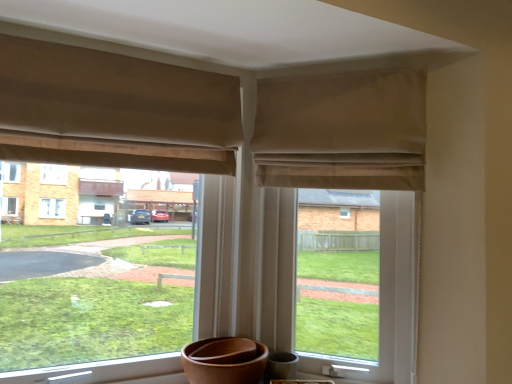
Question: Would you say beige fabric window at center is a long distance from beige fabric curtain at upper left, which appears as the 1th curtain when viewed from the left?

Choices:
 (A) no
 (B) yes

Answer: (A)

Question: Can you confirm if beige fabric window at center is shorter than beige fabric curtain at upper left, the second curtain in the right-to-left sequence?

Choices:
 (A) no
 (B) yes

Answer: (A)

Question: Is beige fabric window at center positioned in front of beige fabric curtain at upper left, the second curtain in the right-to-left sequence?

Choices:
 (A) no
 (B) yes

Answer: (A)

Question: Is beige fabric window at center further to the viewer compared to beige fabric curtain at upper left, the second curtain in the right-to-left sequence?

Choices:
 (A) yes
 (B) no

Answer: (A)

Question: Can you confirm if beige fabric window at center is bigger than beige fabric curtain at upper left, the second curtain in the right-to-left sequence?

Choices:
 (A) yes
 (B) no

Answer: (A)

Question: From the image's perspective, would you say beige fabric window at center is positioned over beige fabric curtain at upper left, which appears as the 1th curtain when viewed from the left?

Choices:
 (A) no
 (B) yes

Answer: (A)

Question: Is beige fabric window at center positioned behind beige fabric at upper center?

Choices:
 (A) yes
 (B) no

Answer: (B)

Question: Is beige fabric window at center far from beige fabric at upper center?

Choices:
 (A) no
 (B) yes

Answer: (A)

Question: Does beige fabric window at center have a greater height compared to beige fabric at upper center?

Choices:
 (A) yes
 (B) no

Answer: (B)

Question: From the image's perspective, is beige fabric window at center on top of beige fabric at upper center?

Choices:
 (A) yes
 (B) no

Answer: (A)

Question: Does beige fabric window at center have a larger size compared to beige fabric at upper center?

Choices:
 (A) yes
 (B) no

Answer: (A)

Question: Can you confirm if beige fabric window at center is positioned to the left of beige fabric at upper center?

Choices:
 (A) yes
 (B) no

Answer: (A)

Question: Does beige fabric at upper center come in front of beige fabric window at center?

Choices:
 (A) yes
 (B) no

Answer: (B)